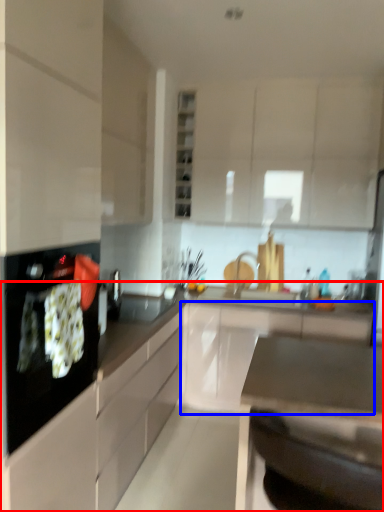
Question: Among these objects, which one is nearest to the camera, countertop (highlighted by a red box) or cabinetry (highlighted by a blue box)?

Choices:
 (A) countertop
 (B) cabinetry

Answer: (A)